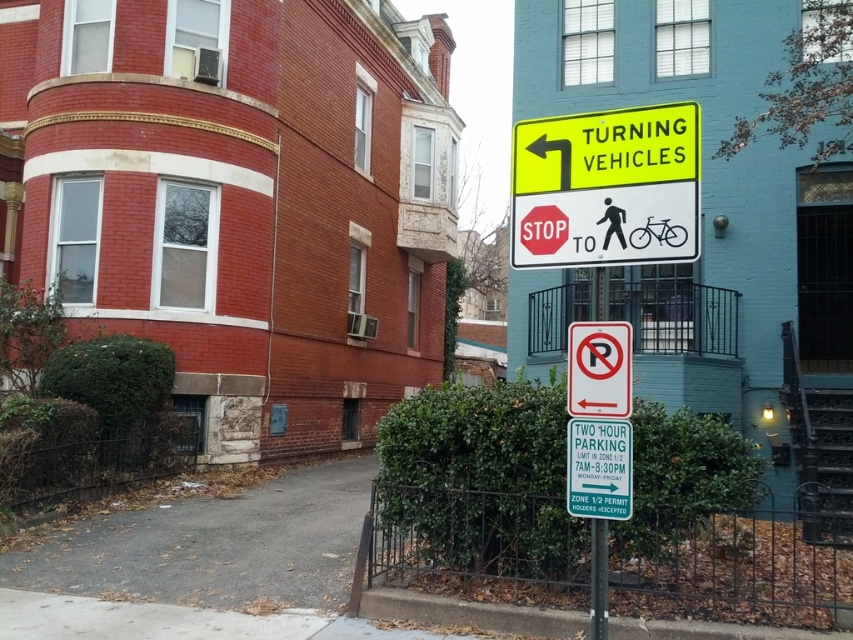
Question: Is yellow reflective plastic sign at upper center below white paper no-parking sign at upper center?

Choices:
 (A) no
 (B) yes

Answer: (A)

Question: Which of the following is the closest to the observer?

Choices:
 (A) (538, 211)
 (B) (590, 509)

Answer: (B)

Question: Does green plastic sign at center have a larger size compared to white paper no-parking sign at upper center?

Choices:
 (A) no
 (B) yes

Answer: (A)

Question: Which is farther from the red matte stop sign at center?

Choices:
 (A) yellow reflective plastic sign at upper center
 (B) green plastic sign at center
 (C) white paper no-parking sign at upper center

Answer: (B)

Question: Does green plastic sign at center have a smaller size compared to white paper no-parking sign at upper center?

Choices:
 (A) yes
 (B) no

Answer: (A)

Question: Estimate the real-world distances between objects in this image. Which object is farther from the green plastic sign at center?

Choices:
 (A) white paper no-parking sign at upper center
 (B) metallic pole at lower center

Answer: (B)